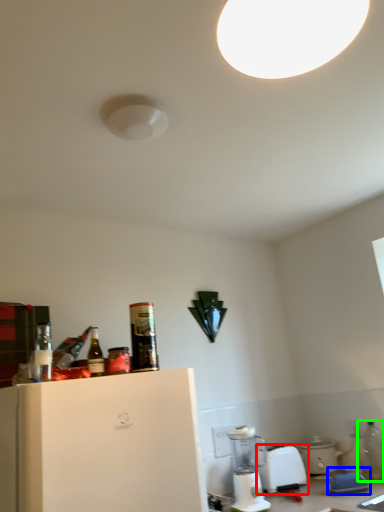
Question: Considering the real-world distances, which object is farthest from kitchen appliance (highlighted by a red box)? appliance (highlighted by a blue box) or bottle (highlighted by a green box)?

Choices:
 (A) appliance
 (B) bottle

Answer: (B)